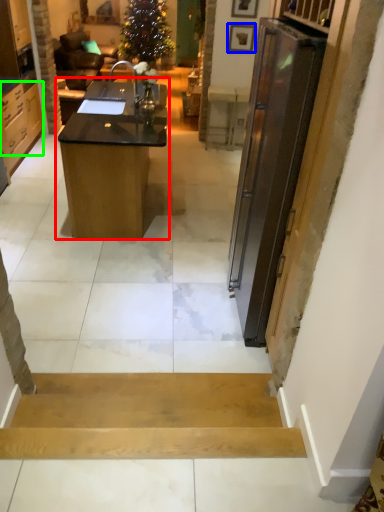
Question: Which is nearer to the desk (highlighted by a red box)? picture frame (highlighted by a blue box) or cabinetry (highlighted by a green box).

Choices:
 (A) picture frame
 (B) cabinetry

Answer: (B)